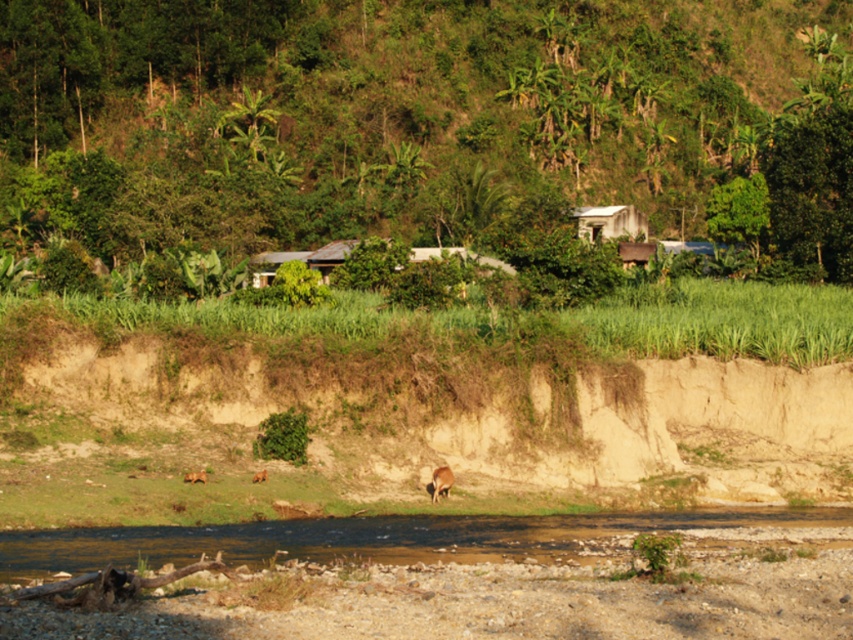
Question: Which of the following is the farthest from the observer?

Choices:
 (A) brown furry dog at lower left
 (B) white corrugated metal hut at upper center

Answer: (B)

Question: Which point is farther from the camera taking this photo?

Choices:
 (A) (448, 552)
 (B) (256, 474)
 (C) (635, 228)
 (D) (196, 472)

Answer: (C)

Question: Can you confirm if brown gravel river at lower center is thinner than brown furry dog at lower center?

Choices:
 (A) no
 (B) yes

Answer: (A)

Question: Can you confirm if brown gravel river at lower center is smaller than brown furry dog at center?

Choices:
 (A) yes
 (B) no

Answer: (B)

Question: Is brown gravel river at lower center to the right of brown furry dog at lower left from the viewer's perspective?

Choices:
 (A) yes
 (B) no

Answer: (A)

Question: Which object is the farthest from the brown furry dog at lower center?

Choices:
 (A) brown furry dog at center
 (B) brown furry dog at lower left
 (C) green leafy hillside at upper center

Answer: (C)